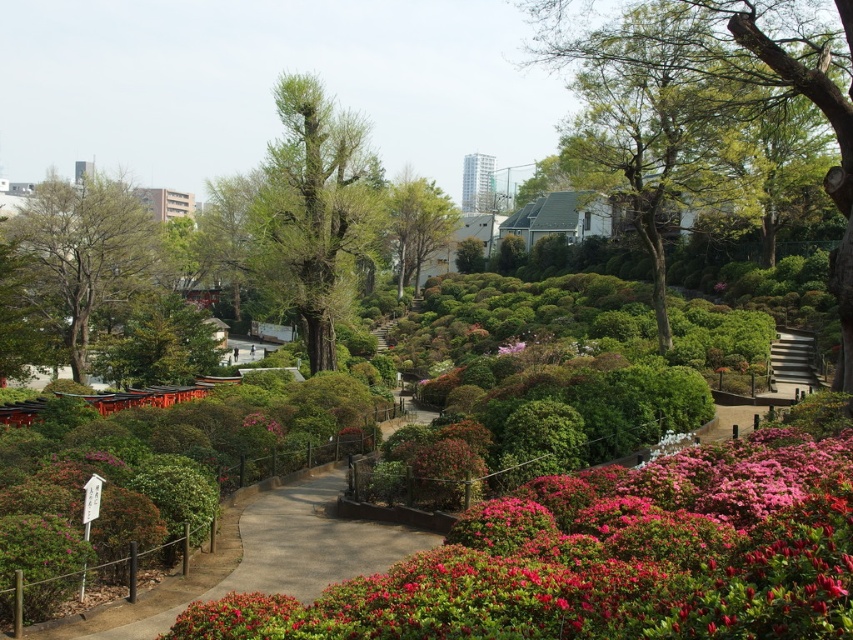
You are standing at the torii gate in the park and want to walk to the point that is closer to you. Which point should you head towards, point (445,624) or point (508,588)?

Point (445,624) is closer to the camera than point (508,588), so you should head towards point (445,624).

You are a gardener planning to plant a new tree in the park. You have a limited space that can accommodate a large tree. Based on the scene, which object between the green rough bark tree at left and the pink matte flower at center would you choose for planting in this space?

The green rough bark tree at left is bigger than the pink matte flower at center, so it would be more suitable for the space that can accommodate a large tree.

You are standing at the torii gate in the park and want to take a photo of both the point at coordinates point (432, 212) and the point at coordinates point (250, 417). Which point will appear closer to the camera in the photo?

Point (432, 212) is further to the camera than point (250, 417), so point (250, 417) will appear closer to the camera in the photo.